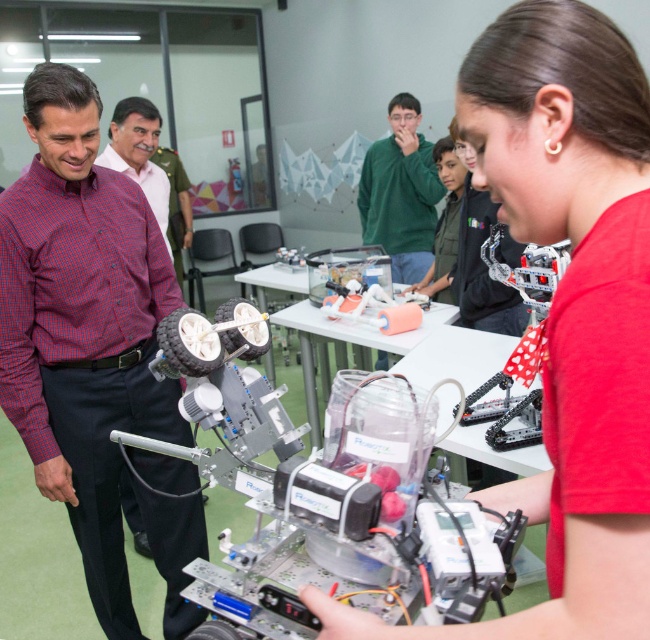
Question: Which object is positioned farthest from the red checkered shirt at center?

Choices:
 (A) red checkered shirt at left
 (B) green matte sweater at center
 (C) plaid shirt at left

Answer: (B)

Question: Can you confirm if green matte sweater at center is wider than plaid shirt at left?

Choices:
 (A) no
 (B) yes

Answer: (B)

Question: Which of the following is the closest to the observer?

Choices:
 (A) green matte sweater at center
 (B) red checkered shirt at center
 (C) plaid shirt at left

Answer: (B)

Question: Which is nearer to the red checkered shirt at center?

Choices:
 (A) red checkered shirt at left
 (B) green matte sweater at center

Answer: (A)

Question: Is red checkered shirt at left wider than green matte sweater at center?

Choices:
 (A) yes
 (B) no

Answer: (B)

Question: Does green matte sweater at center appear over plaid shirt at left?

Choices:
 (A) yes
 (B) no

Answer: (A)